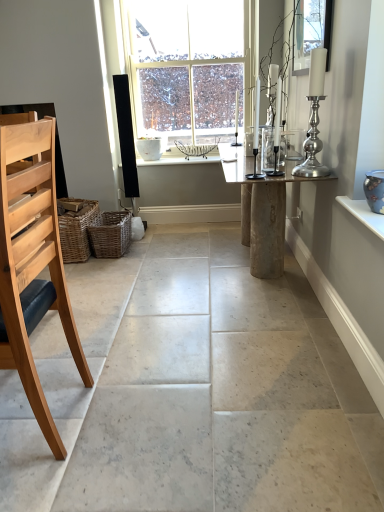
Question: From a real-world perspective, relative to natural wood chair at left, is clear glass candlestick at upper right vertically above or below?

Choices:
 (A) below
 (B) above

Answer: (B)

Question: In terms of width, does clear glass candlestick at upper right look wider or thinner when compared to natural wood chair at left?

Choices:
 (A) thin
 (B) wide

Answer: (A)

Question: Which object is positioned farthest from the woven brown basket at lower left, arranged as the 1th basket when viewed from the left?

Choices:
 (A) clear glass window at center
 (B) silver metallic candle holder at upper right
 (C) rustic wood table at center
 (D) natural wood chair at left
 (E) blue glossy vase at upper right

Answer: (E)

Question: Which object is the farthest from the woven brown basket at lower left, arranged as the second basket when viewed from the right?

Choices:
 (A) woven brown basket at lower left, positioned as the first basket in right-to-left order
 (B) natural wood chair at left
 (C) blue glossy vase at upper right
 (D) white marble window sill at center
 (E) clear glass window at center

Answer: (C)